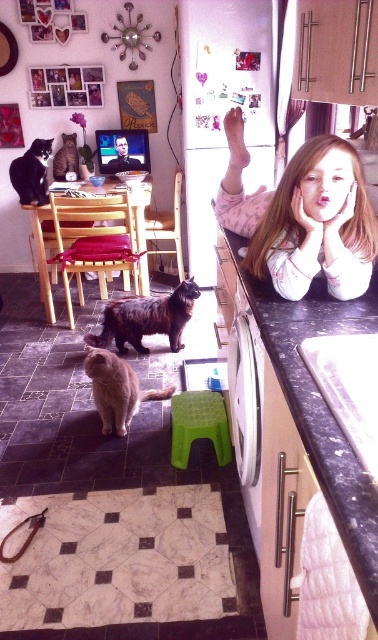
You are a photographer trying to capture a candid shot of the orange fur cat at center and the smooth skin girl at upper right. Since you want to focus on the cat, where should you position the girl to ensure the cat remains the main subject?

The smooth skin girl at upper right is positioned on the right side of orange fur cat at center. To keep the cat as the main subject, you should move the girl to the side so the cat stays centered in the frame.

You are standing in the kitchen and notice two points marked in the scene. The first point is at coordinate point (336, 230) and the second is at point (119, 365). Which point is closer to you?

Point (336, 230) is closer to the viewer than point (119, 365).

You are a photographer trying to capture a closeup shot of the black granite countertop at center. You are currently standing 24 inches away from it. Can you get closer to take the photo without moving the camera?

The black granite countertop at center and camera are 25.84 inches apart from each other. Since you are only 24 inches away, you can move 1.84 inches closer to the countertop to take the photo without moving the camera.